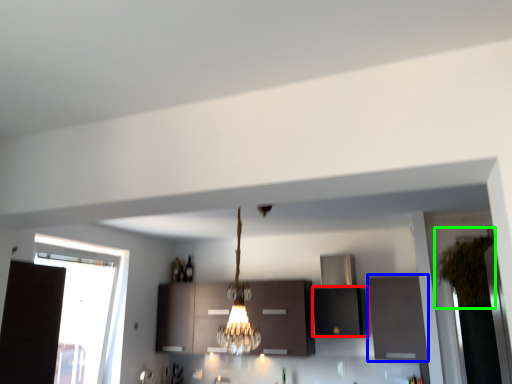
Question: Which is farther away from cabinetry (highlighted by a red box)? cabinetry (highlighted by a blue box) or plant (highlighted by a green box)?

Choices:
 (A) cabinetry
 (B) plant

Answer: (B)